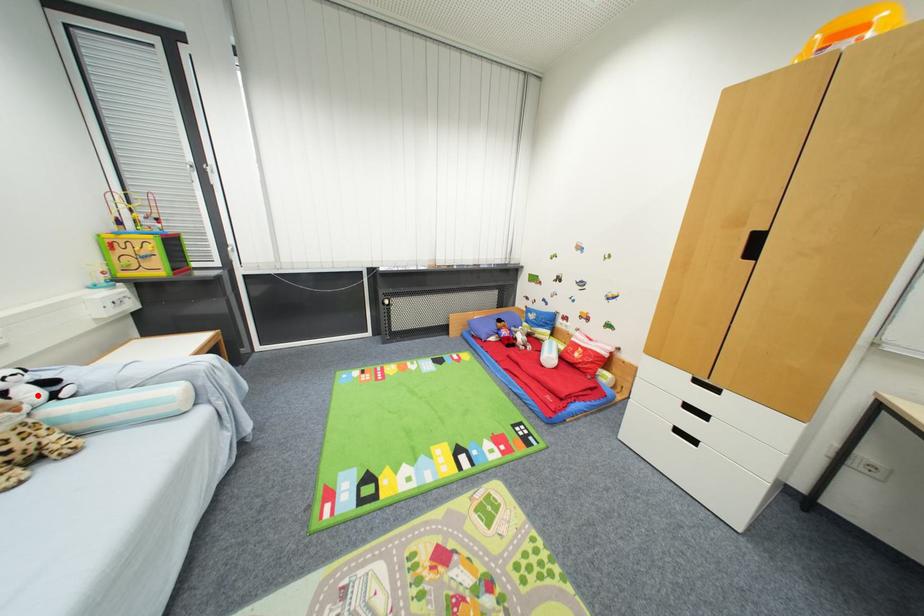
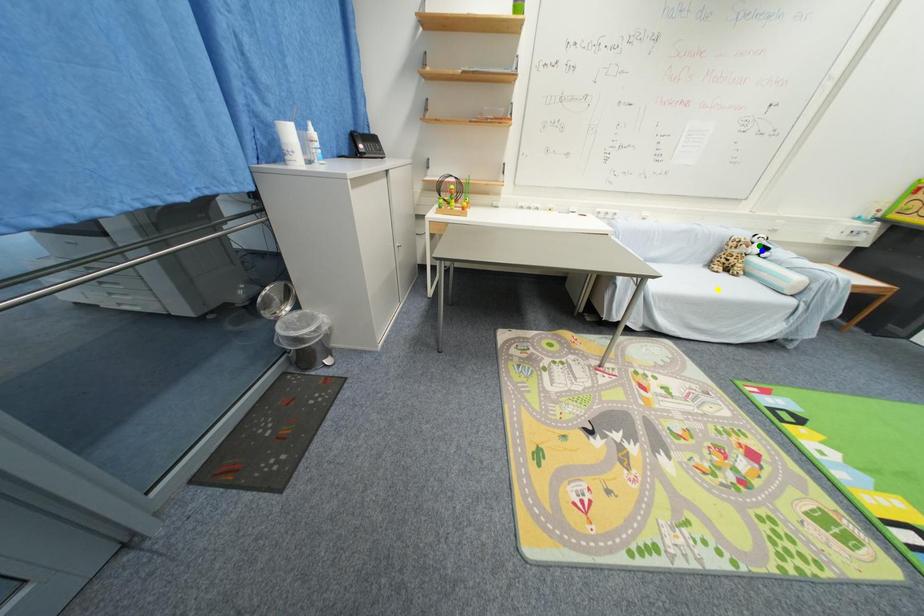
Question: I am providing you with two images of the same scene from different viewpoints. A red point is marked on the first image. You are given multiple points on the second image. Which point in image 2 is actually the same real-world point as the red point in image 1?

Choices:
 (A) green point
 (B) yellow point
 (C) blue point

Answer: (C)